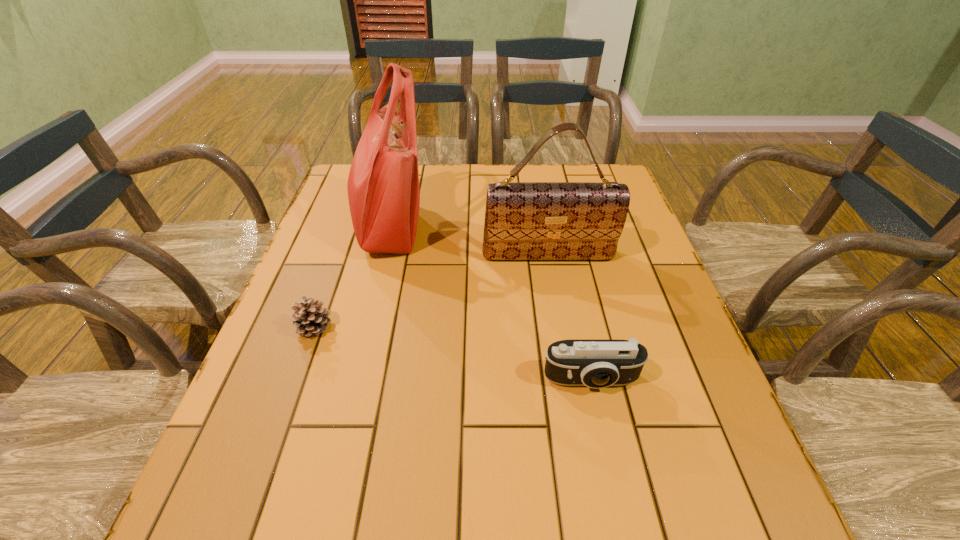
You are a GUI agent. You are given a task and a screenshot of the screen. Output one action in this format:
    pyautogui.click(x=<x>, y=<y>)
    Task: Click on the tallest object
    
    Given the screenshot: What is the action you would take?
    pyautogui.click(x=383, y=187)

You are a GUI agent. You are given a task and a screenshot of the screen. Output one action in this format:
    pyautogui.click(x=<x>, y=<y>)
    Task: Click on the left handbag
    The image size is (960, 540).
    Given the screenshot: What is the action you would take?
    pyautogui.click(x=383, y=187)

This screenshot has width=960, height=540. In order to click on the third shortest object in this screenshot , I will do `click(523, 220)`.

Where is `the shorter handbag`? the shorter handbag is located at coordinates (523, 220).

Locate an element on the screen. camera is located at coordinates (597, 364).

Where is `the nearest object`? The height and width of the screenshot is (540, 960). the nearest object is located at coordinates (597, 364).

Where is `the shortest object`? The height and width of the screenshot is (540, 960). the shortest object is located at coordinates (309, 318).

At what (x,y) coordinates should I click in order to perform the action: click on pinecone. Please return your answer as a coordinate pair (x, y). Looking at the image, I should click on (309, 318).

The height and width of the screenshot is (540, 960). I want to click on vacant space situated on the front-facing side of the taller handbag, so click(x=474, y=226).

Image resolution: width=960 pixels, height=540 pixels. I want to click on free spot located 0.130m on the front of the right handbag with the clasp, so (x=557, y=303).